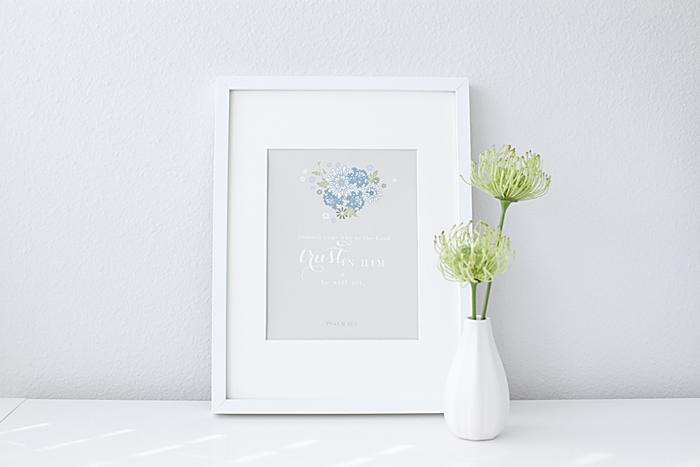
Identify the location of white wall. (610, 316).